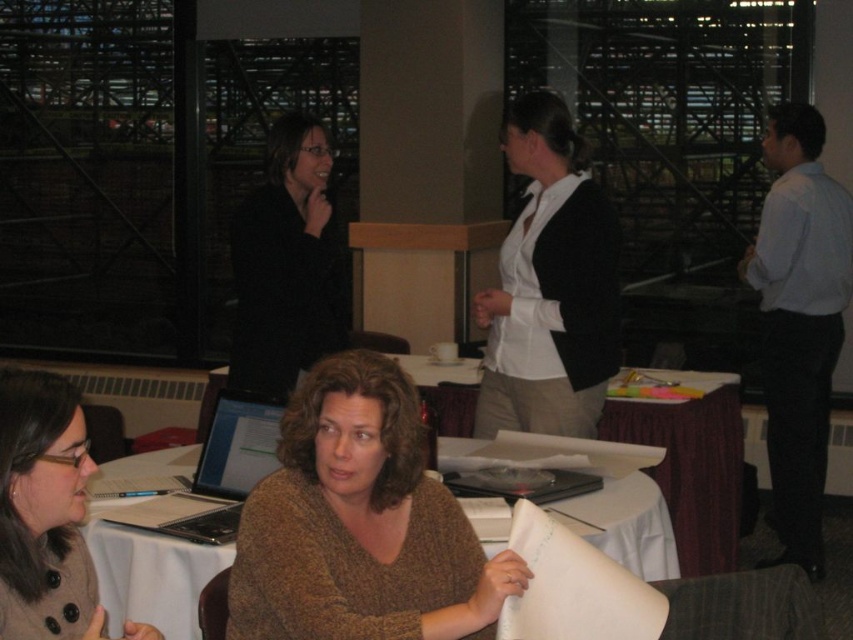
Question: Where is white paper at center located in relation to brown wool sweater at lower left in the image?

Choices:
 (A) above
 (B) below

Answer: (B)

Question: Is brown soft sweater at center wider than white paper at center?

Choices:
 (A) yes
 (B) no

Answer: (B)

Question: Which object is positioned farthest from the brown soft sweater at center?

Choices:
 (A) white matte shirt at center
 (B) white paper at center

Answer: (A)

Question: Is brown soft sweater at center above white matte shirt at center?

Choices:
 (A) yes
 (B) no

Answer: (B)

Question: Which point appears farthest from the camera in this image?

Choices:
 (A) (408, 552)
 (B) (577, 442)

Answer: (B)

Question: Which object is farther from the camera taking this photo?

Choices:
 (A) white matte shirt at center
 (B) matte black sweater at center

Answer: (A)